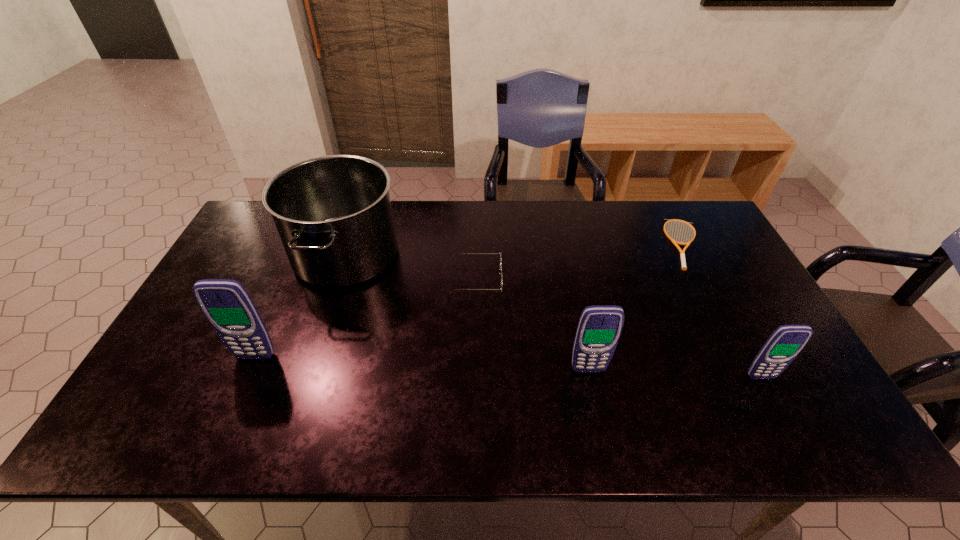
To achieve uniform spacing by inserting another cellular_telephone among them, please point to a free space for this new cellular_telephone. Please provide its 2D coordinates. Your answer should be formatted as a tuple, i.e. [(x, y)], where the tuple contains the x and y coordinates of a point satisfying the conditions above.

[(420, 363)]